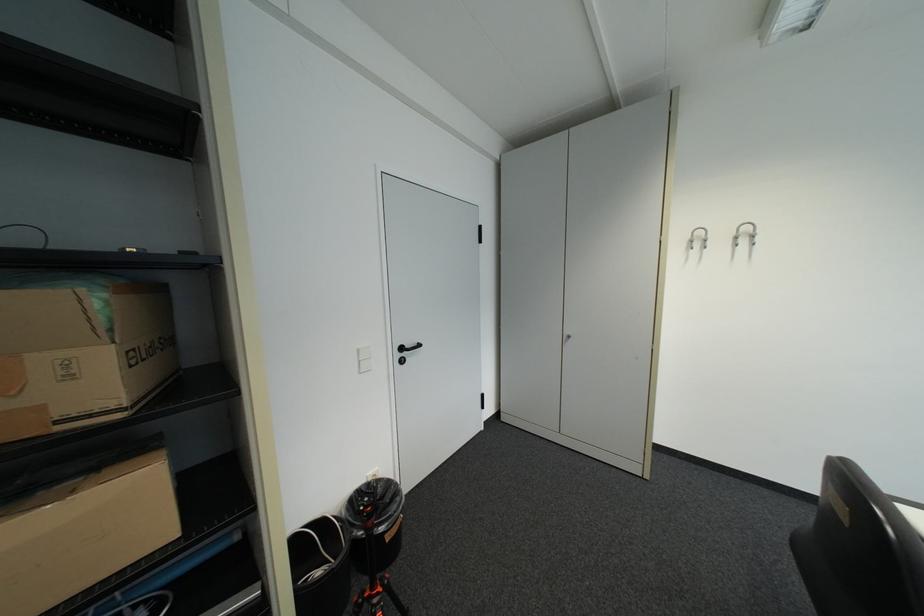
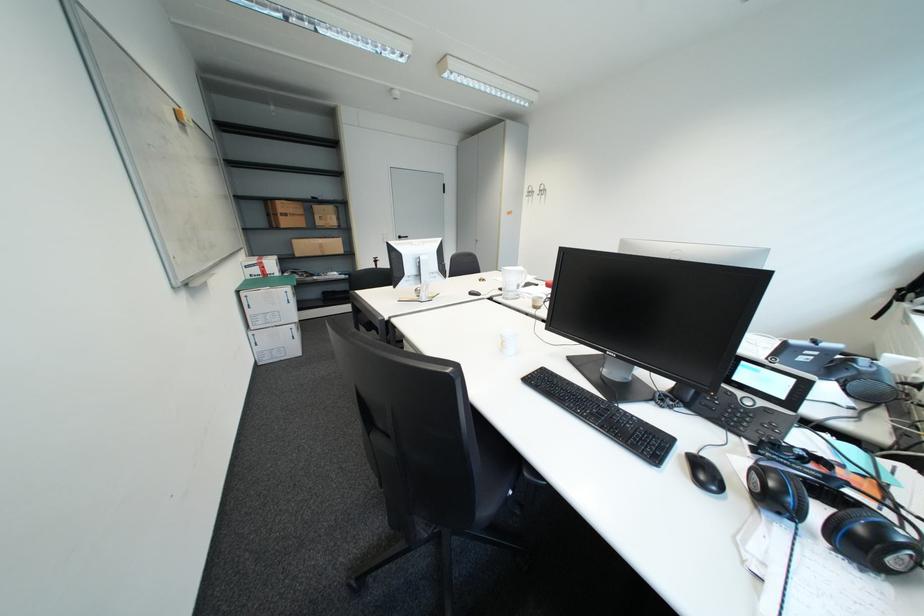
What movement of the cameraman would produce the second image?

The cameraman moved toward right, backward.